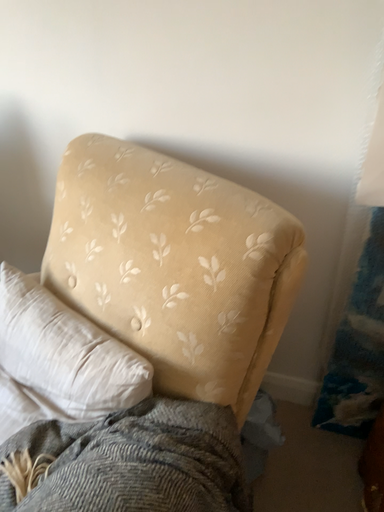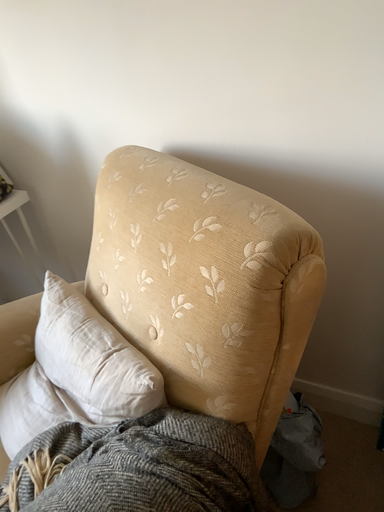
Question: Which way did the camera rotate in the video?

Choices:
 (A) rotated left
 (B) rotated right

Answer: (A)